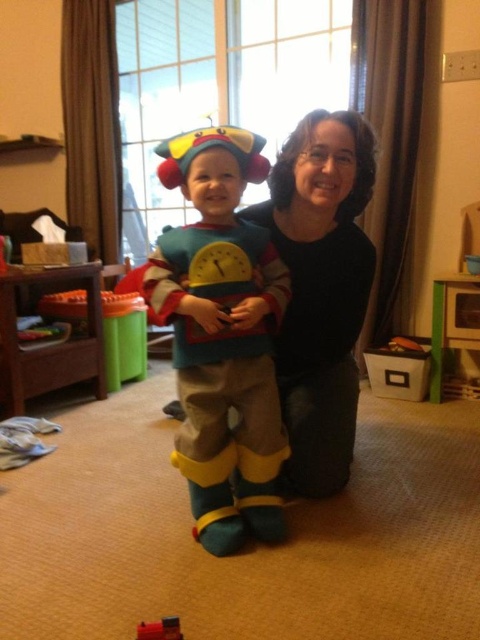
You are a photographer setting up for a photo shoot. You need to position a light source so that it illuminates both the fuzzy yellow costume at center and the metallic red toy at lower left. Considering their heights, where should you place the light source to ensure both are well lit?

The fuzzy yellow costume at center is taller than the metallic red toy at lower left. To ensure both are well lit, place the light source above the fuzzy yellow costume at center so that its light can reach both objects effectively.

You are a photographer setting up for a family photo. You see the fuzzy yellow costume at center and the black fabric at center in the frame. Which costume should you adjust to ensure the smaller one is centered properly?

The fuzzy yellow costume at center is smaller in size compared to the black fabric at center. To ensure the smaller one is centered properly, adjust the fuzzy yellow costume at center to position it correctly in the frame.